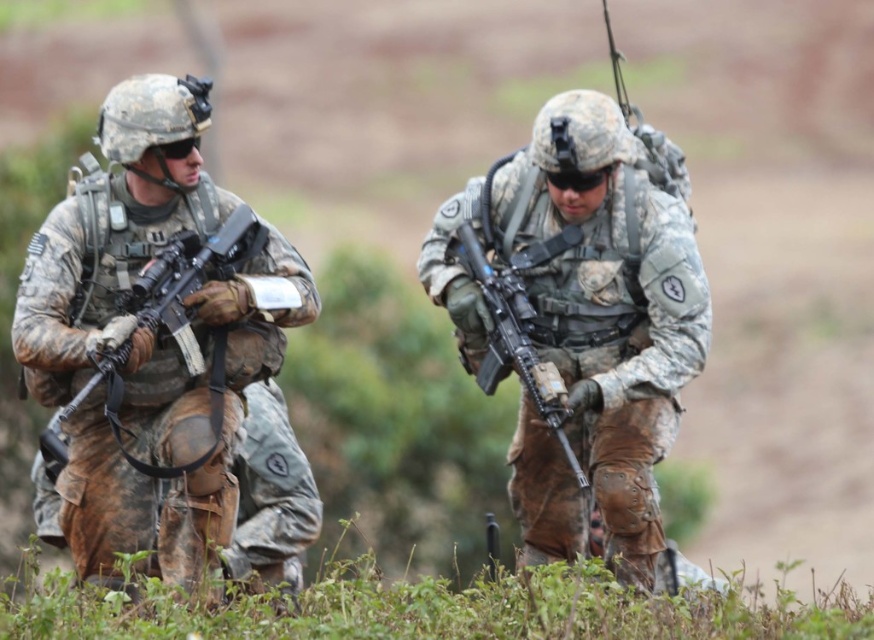
You are a drone operator observing the scene. You need to report the position of the camouflage uniform at left relative to the matte black rifle at center. Based on the scene, what is the correct spatial relationship between them?

The camouflage uniform at left is above the matte black rifle at center.